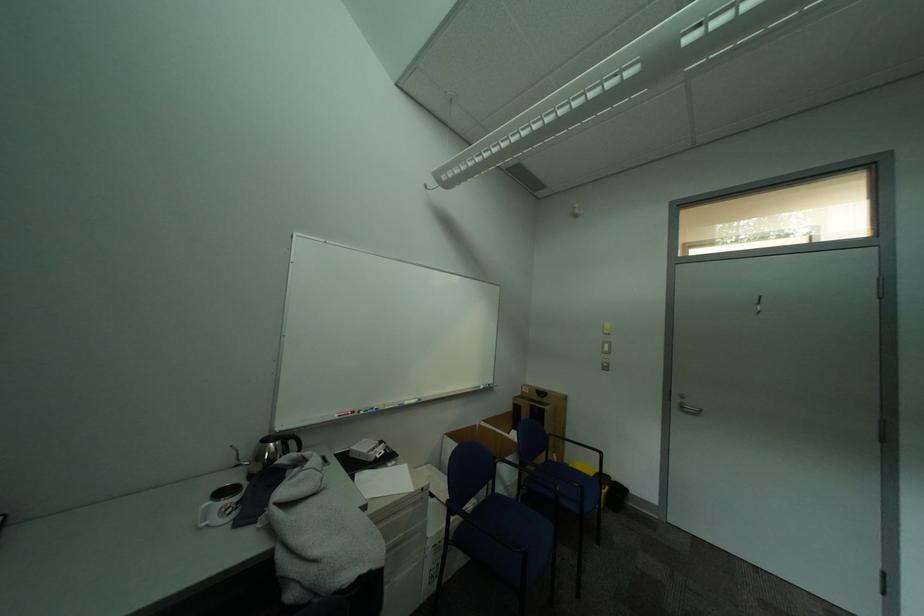
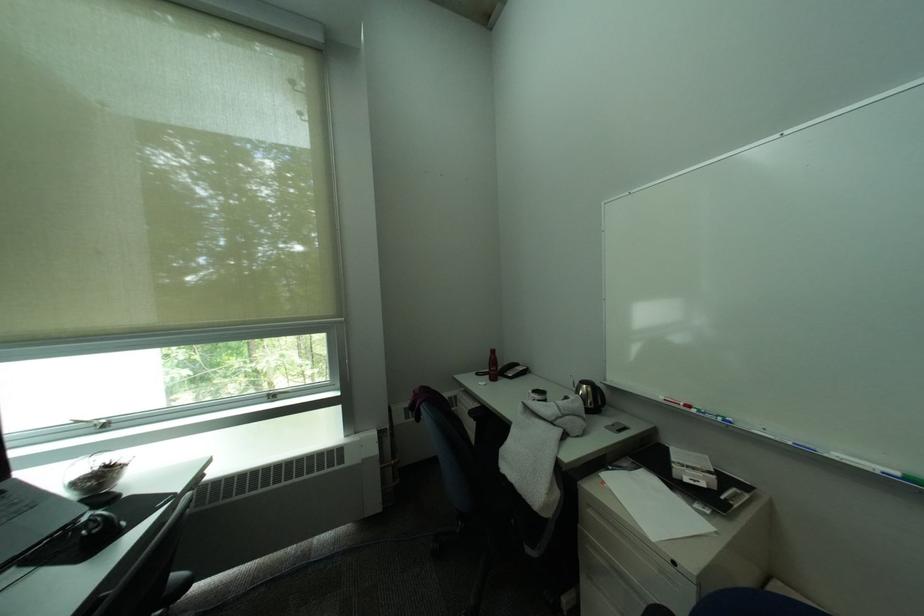
Where in the second image is the point corresponding to (380,411) from the first image?

(719, 416)